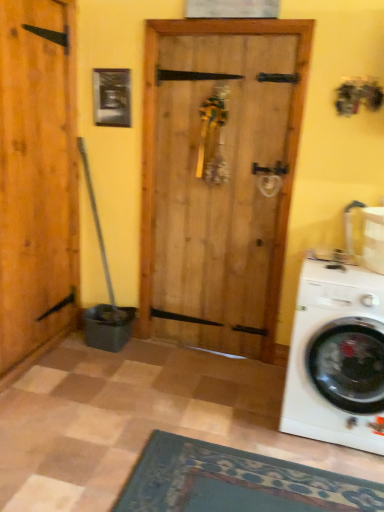
The height and width of the screenshot is (512, 384). What do you see at coordinates (337, 359) in the screenshot?
I see `white glossy washing machine at lower right` at bounding box center [337, 359].

Identify the location of white glossy washing machine at lower right. (337, 359).

Locate an element on the screen. white glossy washing machine at lower right is located at coordinates (337, 359).